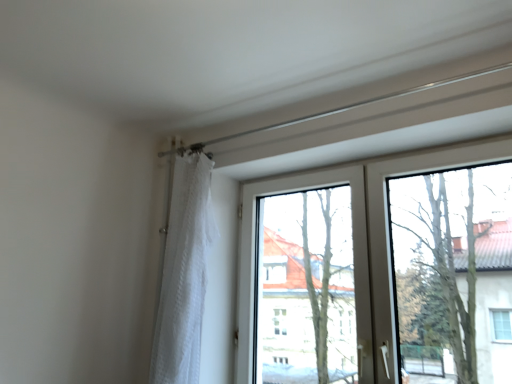
Describe the element at coordinates (454, 272) in the screenshot. I see `transparent glass tree at upper right` at that location.

Image resolution: width=512 pixels, height=384 pixels. I want to click on transparent glass tree at upper right, so click(454, 272).

Is transparent glass window at center shorter than transparent glass tree at upper right?

In fact, transparent glass window at center may be taller than transparent glass tree at upper right.

Is transparent glass window at center not within transparent glass tree at upper right?

Yes.

Is transparent glass window at center in contact with transparent glass tree at upper right?

No, transparent glass window at center is not making contact with transparent glass tree at upper right.

In the scene shown: Based on their sizes in the image, would you say transparent glass window at center is bigger or smaller than transparent glass tree at upper right?

Considering their sizes, transparent glass window at center takes up more space than transparent glass tree at upper right.

At what (x,y) coordinates should I click in order to perform the action: click on window screen in front of the white sheer curtain at left. Please return your answer as a coordinate pair (x, y). Image resolution: width=512 pixels, height=384 pixels. Looking at the image, I should click on (254, 255).

From a real-world perspective, who is located lower, transparent glass window at center or white sheer curtain at left?

transparent glass window at center is physically lower.

Do you think transparent glass window at center is within white sheer curtain at left, or outside of it?

The correct answer is: outside.

Is the surface of transparent glass window at center in direct contact with white sheer curtain at left?

transparent glass window at center and white sheer curtain at left are not in contact.

Who is shorter, white sheer curtain at left or transparent glass tree at upper right?

Standing shorter between the two is transparent glass tree at upper right.

Considering the positions of objects white sheer curtain at left and transparent glass tree at upper right in the image provided, who is behind, white sheer curtain at left or transparent glass tree at upper right?

white sheer curtain at left is further away from the camera.

Can you confirm if white sheer curtain at left is smaller than transparent glass tree at upper right?

Actually, white sheer curtain at left might be larger than transparent glass tree at upper right.

From a real-world perspective, is transparent glass tree at upper right located beneath transparent glass window at center?

No, from a real-world perspective, transparent glass tree at upper right is not beneath transparent glass window at center.

Which is more to the right, transparent glass tree at upper right or transparent glass window at center?

From the viewer's perspective, transparent glass tree at upper right appears more on the right side.

Is transparent glass tree at upper right positioned far away from transparent glass window at center?

No, there isn't a large distance between transparent glass tree at upper right and transparent glass window at center.

From the image's perspective, between transparent glass tree at upper right and transparent glass window at center, who is located below?

transparent glass window at center is shown below in the image.

In the scene shown: Is white sheer curtain at left not inside transparent glass window at center?

Yes, white sheer curtain at left is located beyond the bounds of transparent glass window at center.

Is the depth of white sheer curtain at left less than that of transparent glass window at center?

No, the depth of white sheer curtain at left is greater than that of transparent glass window at center.

Which is more to the right, white sheer curtain at left or transparent glass window at center?

transparent glass window at center is more to the right.

From a real-world perspective, is transparent glass tree at upper right physically located above or below white sheer curtain at left?

Clearly, from a real-world perspective, transparent glass tree at upper right is above white sheer curtain at left.

Looking at their sizes, would you say transparent glass tree at upper right is wider or thinner than white sheer curtain at left?

Clearly, transparent glass tree at upper right has less width compared to white sheer curtain at left.

How distant is transparent glass tree at upper right from white sheer curtain at left?

transparent glass tree at upper right is 3.33 feet from white sheer curtain at left.

Is point (490, 230) behind point (194, 286)?

That is False.

Locate an element on the screen. This screenshot has height=384, width=512. window screen below the transparent glass tree at upper right (from a real-world perspective) is located at coordinates (254, 255).

I want to click on curtain above the transparent glass window at center (from a real-world perspective), so click(184, 274).

Based on their spatial positions, is white sheer curtain at left or transparent glass tree at upper right further from transparent glass window at center?

white sheer curtain at left lies further to transparent glass window at center than the other object.

Based on the photo, which object lies further to the anchor point transparent glass tree at upper right, transparent glass window at center or white sheer curtain at left?

Among the two, white sheer curtain at left is located further to transparent glass tree at upper right.

Looking at the image, which one is located closer to white sheer curtain at left, transparent glass tree at upper right or transparent glass window at center?

Among the two, transparent glass window at center is located nearer to white sheer curtain at left.

From the picture: Considering their positions, is transparent glass window at center positioned closer to white sheer curtain at left than transparent glass tree at upper right?

transparent glass window at center is positioned closer to the anchor white sheer curtain at left.

Which object lies nearer to the anchor point transparent glass window at center, transparent glass tree at upper right or white sheer curtain at left?

transparent glass tree at upper right is positioned closer to the anchor transparent glass window at center.

Based on their spatial positions, is white sheer curtain at left or transparent glass window at center further from transparent glass tree at upper right?

white sheer curtain at left lies further to transparent glass tree at upper right than the other object.

Where is `window screen situated between white sheer curtain at left and transparent glass tree at upper right from left to right`? window screen situated between white sheer curtain at left and transparent glass tree at upper right from left to right is located at coordinates (254, 255).